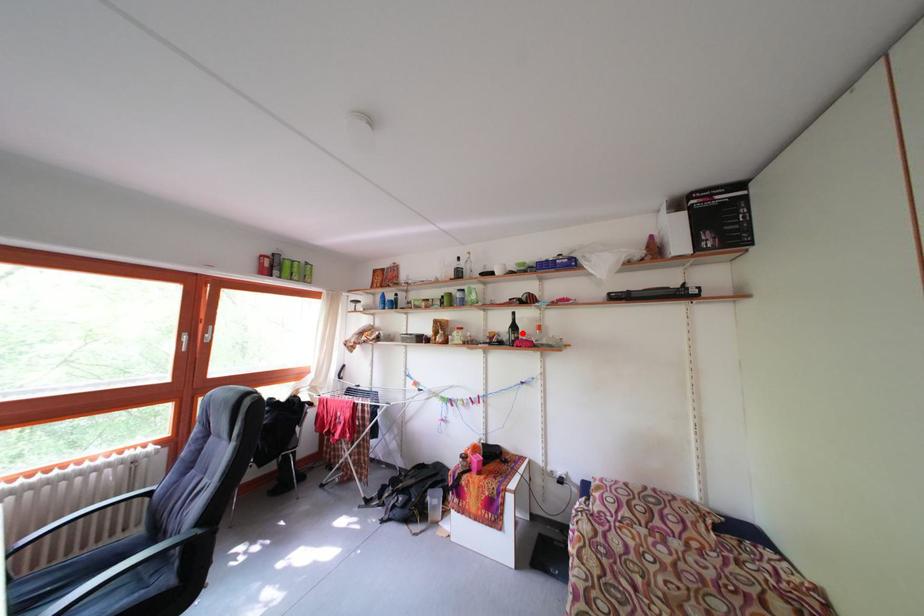
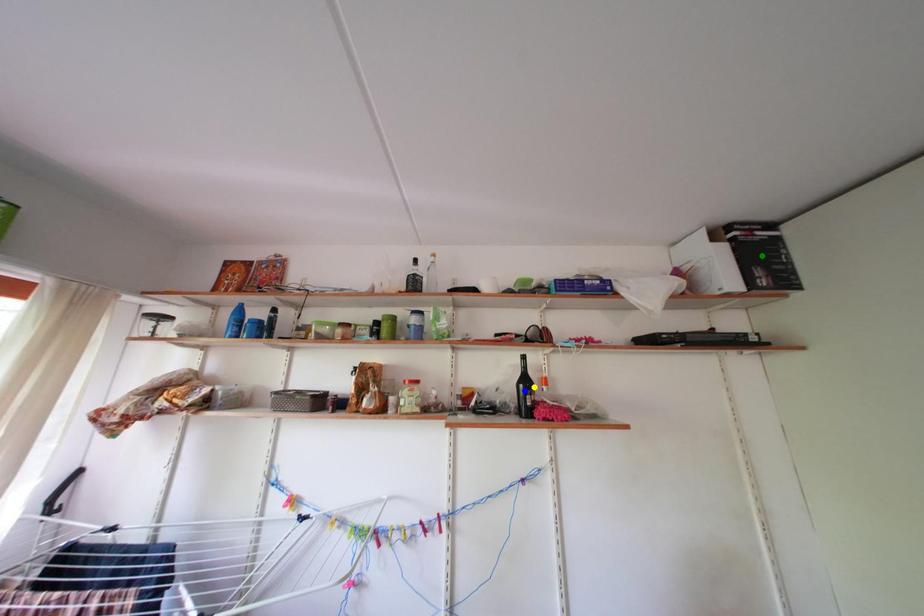
Question: I am providing you with two images of the same scene from different viewpoints. A red point is marked on the first image. You are given multiple points on the second image. Which spot in image 2 lines up with the point in image 1?

Choices:
 (A) yellow point
 (B) green point
 (C) blue point

Answer: (A)